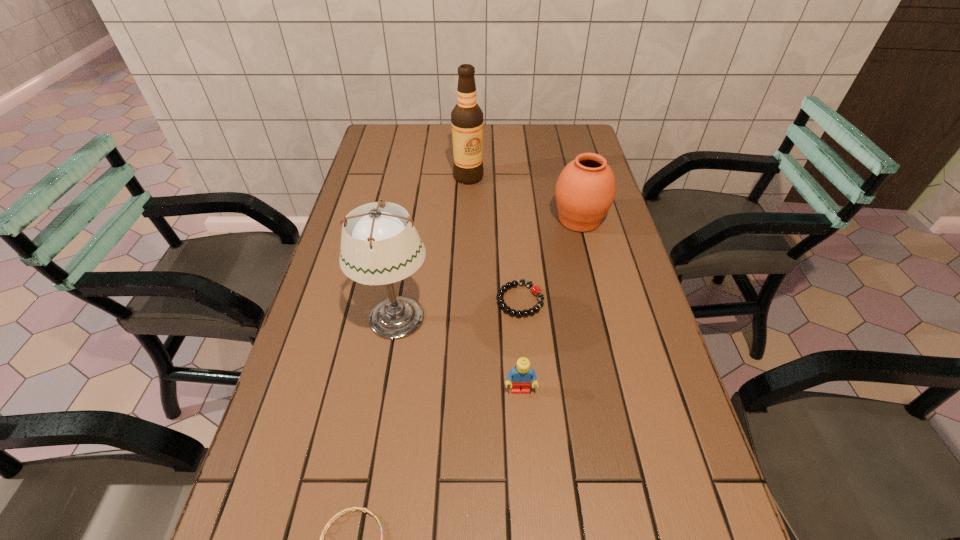
Image resolution: width=960 pixels, height=540 pixels. In order to click on object that is the second closest to the shortest object in this screenshot , I will do `click(380, 245)`.

Image resolution: width=960 pixels, height=540 pixels. Identify the location of free space in the image that satisfies the following two spatial constraints: 1. on the label of the alcohol; 2. on the left side of the urn. (468, 220).

You are a GUI agent. You are given a task and a screenshot of the screen. Output one action in this format:
    pyautogui.click(x=<x>, y=<y>)
    Task: Click on the vacant space that satisfies the following two spatial constraints: 1. on the label of the right bracelet; 2. on the right side of the farthest object
    The width and height of the screenshot is (960, 540).
    Given the screenshot: What is the action you would take?
    pyautogui.click(x=465, y=300)